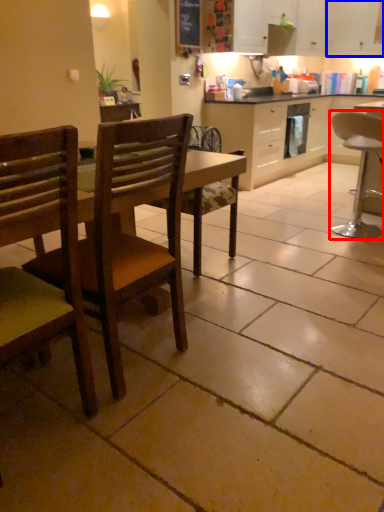
Question: Which of the following is the closest to the observer, chair (highlighted by a red box) or cabinetry (highlighted by a blue box)?

Choices:
 (A) chair
 (B) cabinetry

Answer: (A)